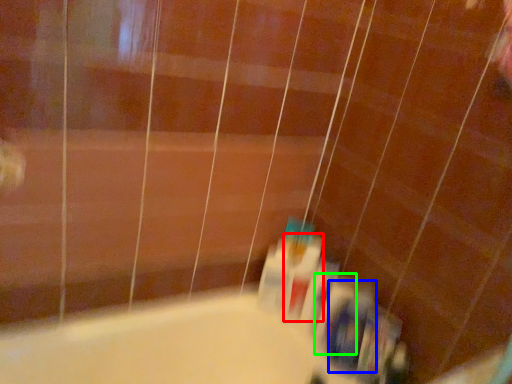
Question: Based on their relative distances, which object is nearer to mouthwash (highlighted by a red box)? Choose from toiletry (highlighted by a blue box) and toiletry (highlighted by a green box).

Choices:
 (A) toiletry
 (B) toiletry

Answer: (B)